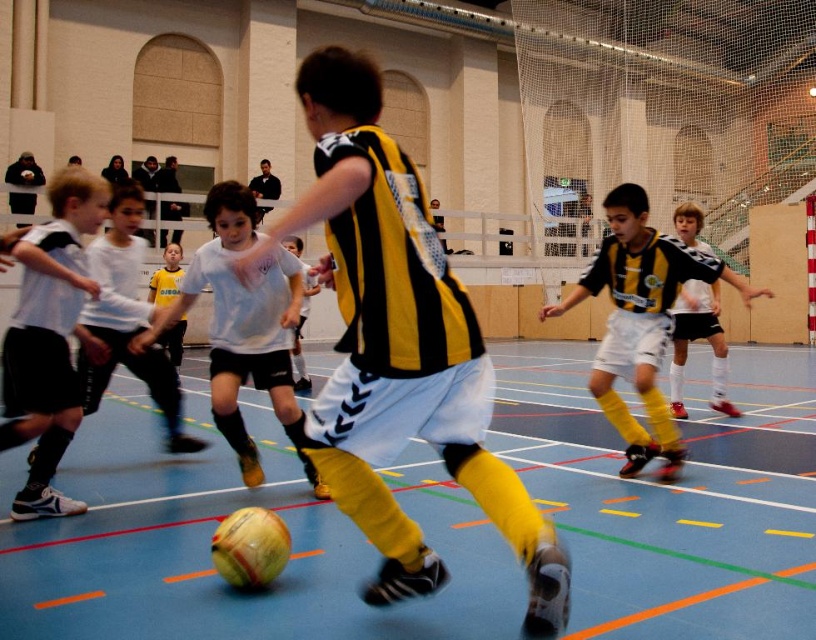
Question: Can you confirm if rubberized blue floor at center is wider than white matte jersey at center?

Choices:
 (A) yes
 (B) no

Answer: (A)

Question: Among these points, which one is farthest from the camera?

Choices:
 (A) [x=289, y=298]
 (B) [x=606, y=378]

Answer: (B)

Question: Which object appears closest to the camera in this image?

Choices:
 (A) yellow/black striped jersey at center
 (B) rubberized blue floor at center
 (C) yellow/black jersey at center
 (D) white matte shorts at left

Answer: (A)

Question: Is yellow and black jersey at center below yellow/black jersey at center?

Choices:
 (A) yes
 (B) no

Answer: (B)

Question: Which is farther from the white matte jersey at center?

Choices:
 (A) yellow and black jersey at center
 (B) yellow/black striped jersey at center
 (C) rubberized blue floor at center

Answer: (A)

Question: Does yellow and black jersey at center come behind white matte jersey at center?

Choices:
 (A) no
 (B) yes

Answer: (B)